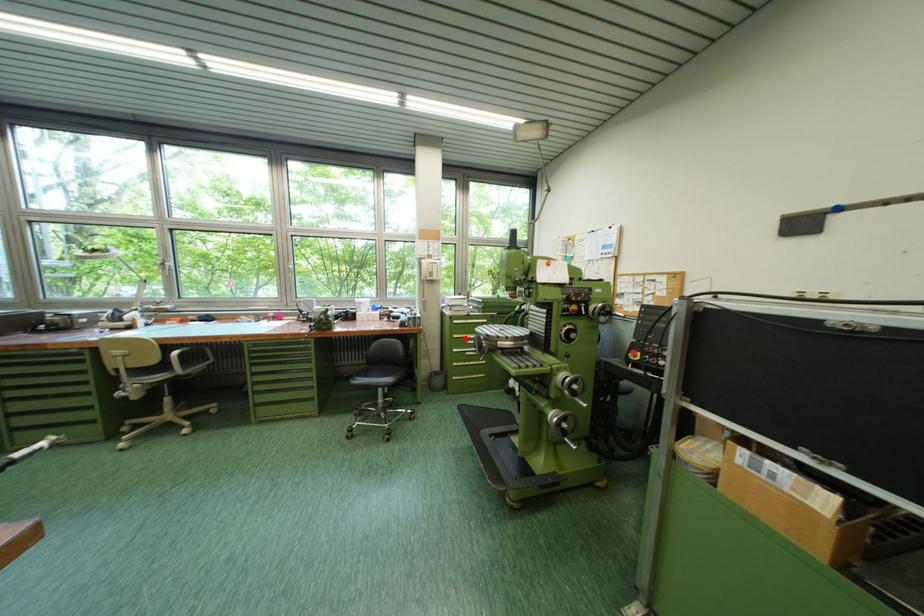
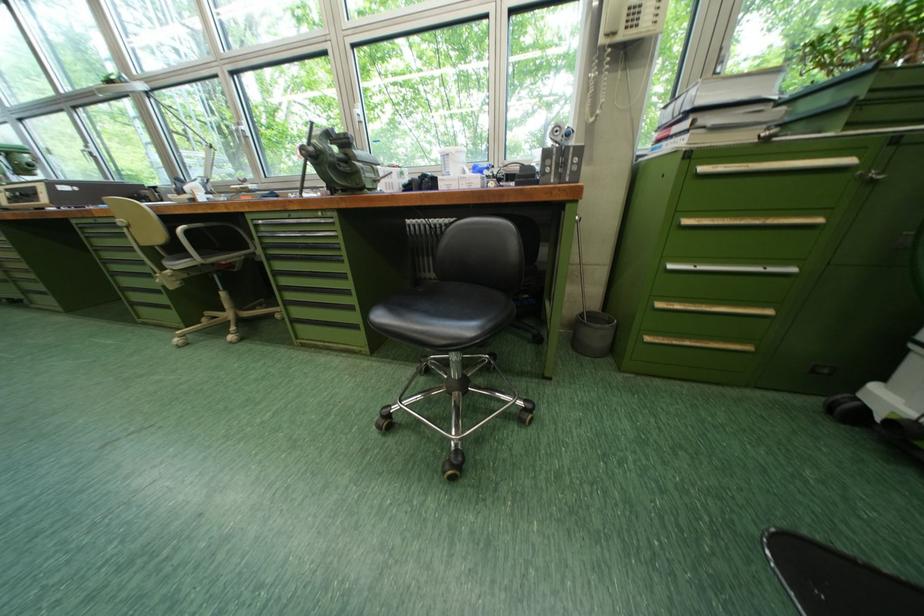
Find the pixel in the second image that matches the highlighted location in the first image.

(698, 224)